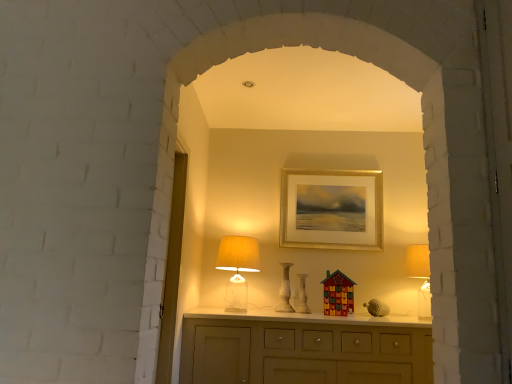
What do you see at coordinates (331, 209) in the screenshot?
I see `gold/glossy picture frame at upper center` at bounding box center [331, 209].

The height and width of the screenshot is (384, 512). Identify the location of gold/glossy picture frame at upper center. pos(331,209).

In order to face translucent glass table lamp at center, should I rotate leftwards or rightwards?

You should look left and rotate roughly 2.424 degrees.

What is the approximate height of transparent glass door at left?

It is 4.96 feet.

This screenshot has height=384, width=512. What are the coordinates of `gold/glossy picture frame at upper center` in the screenshot? It's located at (331, 209).

Is white marble vase at center, which is the first vase in left-to-right order, turned away from transparent glass door at left?

white marble vase at center, which is the first vase in left-to-right order, does not have its back to transparent glass door at left.

Based on the photo, could transparent glass door at left be considered to be inside white marble vase at center, arranged as the 2th vase when viewed from the right?

No, transparent glass door at left is not surrounded by white marble vase at center, arranged as the 2th vase when viewed from the right.

This screenshot has width=512, height=384. What are the coordinates of `glass door above the white marble vase at center, arranged as the 2th vase when viewed from the right (from a real-world perspective)` in the screenshot? It's located at (172, 271).

From the image's perspective, is white marble vase at center, arranged as the 2th vase when viewed from the right, below transparent glass door at left?

Yes.

How many degrees apart are the facing directions of transparent glass door at left and white marble vase at center, which is the first vase in left-to-right order?

They differ by 91.1 degrees in their facing directions.

Is transparent glass door at left turned away from white marble vase at center, arranged as the 2th vase when viewed from the right?

No, transparent glass door at left is not facing away from white marble vase at center, arranged as the 2th vase when viewed from the right.

Which is behind, point (176, 154) or point (287, 274)?

The point (287, 274) is farther.

You are a GUI agent. You are given a task and a screenshot of the screen. Output one action in this format:
    pyautogui.click(x=<x>, y=<y>)
    Task: Click on the 1st vase located beneath the transparent glass door at left (from a real-world perspective)
    This screenshot has height=384, width=512.
    Given the screenshot: What is the action you would take?
    pyautogui.click(x=285, y=291)

Is point (216, 268) positioned behind point (182, 223)?

Yes.

From a real-world perspective, is translucent glass table lamp at center above or below transparent glass door at left?

translucent glass table lamp at center is situated lower than transparent glass door at left in the real world.

Locate an element on the screen. This screenshot has height=384, width=512. table lamp lying behind the transparent glass door at left is located at coordinates (237, 269).

From the image's perspective, is translucent glass table lamp at center located above or below transparent glass door at left?

Clearly, from the image's perspective, translucent glass table lamp at center is below transparent glass door at left.

Is point (298, 295) closer or farther from the camera than point (162, 331)?

Point (298, 295) appears to be farther away from the viewer than point (162, 331).

From a real-world perspective, is white marble vase at center, which ranks as the second vase in left-to-right order, physically below transparent glass door at left?

Indeed, from a real-world perspective, white marble vase at center, which ranks as the second vase in left-to-right order, is positioned beneath transparent glass door at left.

Considering the relative positions of white marble vase at center, the 1th vase viewed from the right, and transparent glass door at left in the image provided, is white marble vase at center, the 1th vase viewed from the right, to the right of transparent glass door at left from the viewer's perspective?

Correct, you'll find white marble vase at center, the 1th vase viewed from the right, to the right of transparent glass door at left.

Is white marble vase at center, which ranks as the second vase in left-to-right order, positioned in front of transparent glass door at left?

No, the depth of white marble vase at center, which ranks as the second vase in left-to-right order, is greater than that of transparent glass door at left.

From the picture: From a real-world perspective, is white marble vase at center, arranged as the 2th vase when viewed from the right, physically located above or below gold/glossy picture frame at upper center?

white marble vase at center, arranged as the 2th vase when viewed from the right, is below gold/glossy picture frame at upper center.

Consider the image. Which is behind, white marble vase at center, arranged as the 2th vase when viewed from the right, or gold/glossy picture frame at upper center?

gold/glossy picture frame at upper center is further away from the camera.

Between white marble vase at center, which is the first vase in left-to-right order, and gold/glossy picture frame at upper center, which one has larger width?

Wider between the two is white marble vase at center, which is the first vase in left-to-right order.

Is white marble vase at center, arranged as the 2th vase when viewed from the right, placed right next to gold/glossy picture frame at upper center?

No, white marble vase at center, arranged as the 2th vase when viewed from the right, is not in contact with gold/glossy picture frame at upper center.

From a real-world perspective, is gold/glossy picture frame at upper center on white marble vase at center, which is the first vase in left-to-right order?

Yes, from a real-world perspective, gold/glossy picture frame at upper center is over white marble vase at center, which is the first vase in left-to-right order

You are a GUI agent. You are given a task and a screenshot of the screen. Output one action in this format:
    pyautogui.click(x=<x>, y=<y>)
    Task: Click on the 1st vase in front of the gold/glossy picture frame at upper center, starting your count from the anchor
    
    Given the screenshot: What is the action you would take?
    click(x=285, y=291)

From the image's perspective, is gold/glossy picture frame at upper center on top of white marble vase at center, arranged as the 2th vase when viewed from the right?

Yes.

Is gold/glossy picture frame at upper center taller or shorter than white marble vase at center, which is the first vase in left-to-right order?

gold/glossy picture frame at upper center is taller than white marble vase at center, which is the first vase in left-to-right order.

Consider the image. Is transparent glass door at left situated inside translucent glass table lamp at center or outside?

transparent glass door at left is outside translucent glass table lamp at center.

Is the position of transparent glass door at left less distant than that of translucent glass table lamp at center?

Yes.

Who is smaller, transparent glass door at left or translucent glass table lamp at center?

With smaller size is translucent glass table lamp at center.

Considering the points (176, 180) and (230, 303), which point is behind, point (176, 180) or point (230, 303)?

The point (230, 303) is farther from the camera.

Locate an element on the screen. the 2nd vase behind the transparent glass door at left, starting your count from the anchor is located at coordinates click(x=285, y=291).

From a real-world perspective, which vase is the 1st one underneath the transparent glass door at left? Please provide its 2D coordinates.

[(285, 291)]

Looking at the image, which one is located closer to translucent glass table lamp at center, white marble vase at center, which is the first vase in left-to-right order, or transparent glass door at left?

The object closer to translucent glass table lamp at center is white marble vase at center, which is the first vase in left-to-right order.

When comparing their distances from gold/glossy picture frame at upper center, does transparent glass door at left or white marble vase at center, which is the first vase in left-to-right order, seem further?

transparent glass door at left.

Based on their spatial positions, is gold/glossy picture frame at upper center or white marble vase at center, which is the first vase in left-to-right order, further from white marble vase at center, which ranks as the second vase in left-to-right order?

gold/glossy picture frame at upper center is positioned further to the anchor white marble vase at center, which ranks as the second vase in left-to-right order.

When comparing their distances from gold/glossy picture frame at upper center, does translucent glass table lamp at center or white marble vase at center, arranged as the 2th vase when viewed from the right, seem closer?

Among the two, white marble vase at center, arranged as the 2th vase when viewed from the right, is located nearer to gold/glossy picture frame at upper center.

Looking at the image, which one is located further to white marble vase at center, which ranks as the second vase in left-to-right order, translucent glass table lamp at center or gold/glossy picture frame at upper center?

Among the two, gold/glossy picture frame at upper center is located further to white marble vase at center, which ranks as the second vase in left-to-right order.

Considering their positions, is translucent glass table lamp at center positioned closer to transparent glass door at left than gold/glossy picture frame at upper center?

Based on the image, translucent glass table lamp at center appears to be nearer to transparent glass door at left.

Looking at the image, which one is located closer to white marble vase at center, arranged as the 2th vase when viewed from the right, translucent glass table lamp at center or white marble vase at center, the 1th vase viewed from the right?

white marble vase at center, the 1th vase viewed from the right.

Based on their spatial positions, is white marble vase at center, the 1th vase viewed from the right, or gold/glossy picture frame at upper center closer to white marble vase at center, which is the first vase in left-to-right order?

Based on the image, white marble vase at center, the 1th vase viewed from the right, appears to be nearer to white marble vase at center, which is the first vase in left-to-right order.

Locate an element on the screen. table lamp between transparent glass door at left and gold/glossy picture frame at upper center along the z-axis is located at coordinates (237, 269).

Find the location of `vase between gold/glossy picture frame at upper center and white marble vase at center, which ranks as the second vase in left-to-right order, in the vertical direction`. vase between gold/glossy picture frame at upper center and white marble vase at center, which ranks as the second vase in left-to-right order, in the vertical direction is located at coordinates (285, 291).

Identify the location of vase between translucent glass table lamp at center and white marble vase at center, which ranks as the second vase in left-to-right order, from left to right. Image resolution: width=512 pixels, height=384 pixels. (285, 291).

At what (x,y) coordinates should I click in order to perform the action: click on vase between transparent glass door at left and white marble vase at center, arranged as the 2th vase when viewed from the right, along the z-axis. Please return your answer as a coordinate pair (x, y). Looking at the image, I should click on (302, 296).